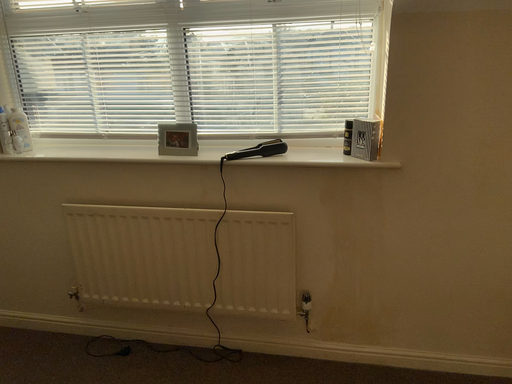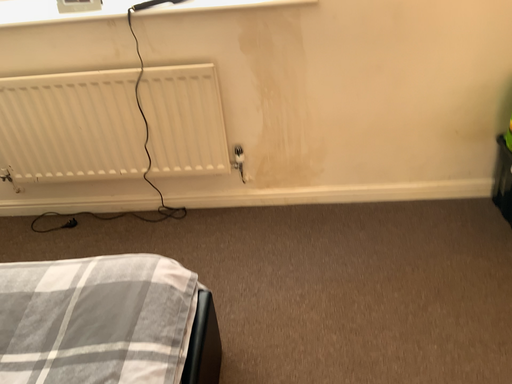
Question: Which way did the camera rotate in the video?

Choices:
 (A) rotated right
 (B) rotated left

Answer: (A)